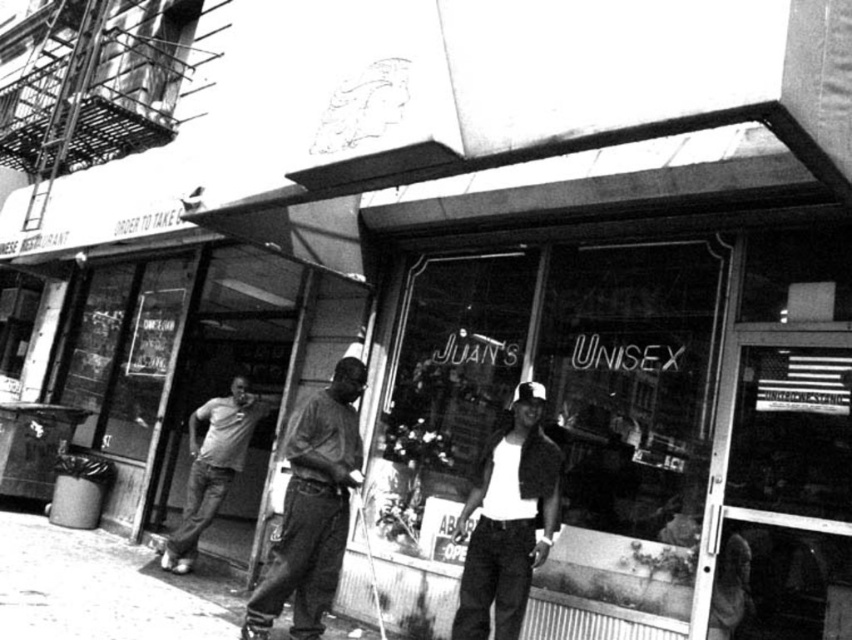
You are a photographer standing at the entrance of Juan s Unisex. You want to take a photo of the dark gray jeans at center and the storefront sign. How far apart are these two objects in the scene?

The dark gray jeans at center and the storefront sign are 3.11 meters apart.